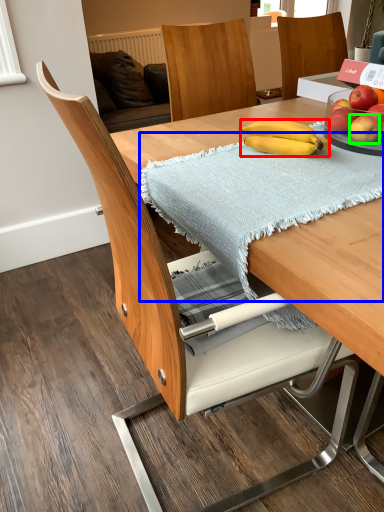
Question: Which is farther away from banana (highlighted by a red box)? blanket (highlighted by a blue box) or apple (highlighted by a green box)?

Choices:
 (A) blanket
 (B) apple

Answer: (A)